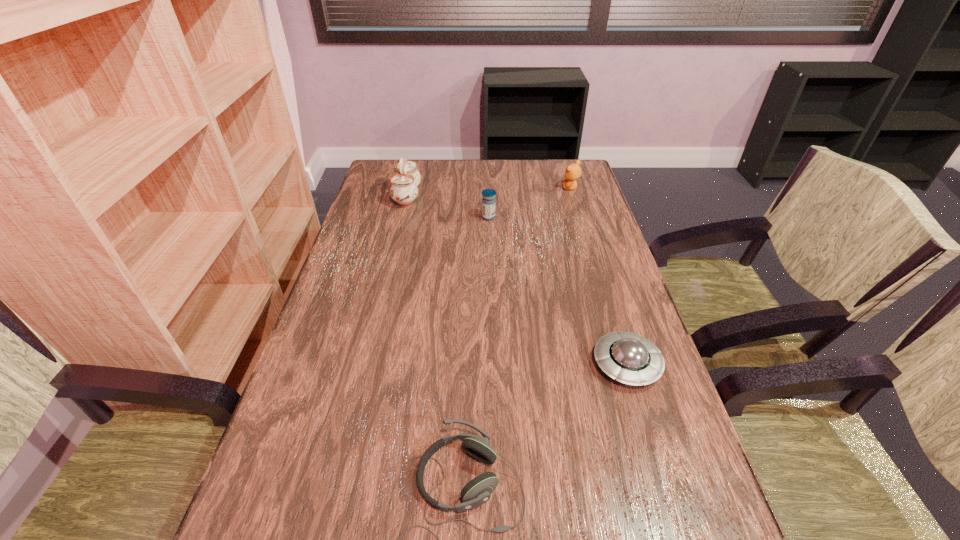
Where is `vacant space at the right edge of the desktop`? vacant space at the right edge of the desktop is located at coordinates (628, 453).

The width and height of the screenshot is (960, 540). Find the location of `vacant space at the far right corner of the desktop`. vacant space at the far right corner of the desktop is located at coordinates (568, 161).

What are the coordinates of `unoccupied area between the tallest object and the second nearest object` in the screenshot? It's located at (516, 280).

You are a GUI agent. You are given a task and a screenshot of the screen. Output one action in this format:
    pyautogui.click(x=<x>, y=<y>)
    Task: Click on the free point between the teddy bear and the saucer
    Image resolution: width=960 pixels, height=540 pixels.
    Given the screenshot: What is the action you would take?
    pyautogui.click(x=599, y=276)

The height and width of the screenshot is (540, 960). I want to click on empty space between the saucer and the third nearest object, so click(558, 291).

Locate an element on the screen. vacant space that's between the chinaware and the second nearest object is located at coordinates (516, 280).

In order to click on free point between the medicine and the second nearest object in this screenshot , I will do `click(558, 291)`.

Identify which object is located as the second nearest to the saucer. Please provide its 2D coordinates. Your answer should be formatted as a tuple, i.e. [(x, y)], where the tuple contains the x and y coordinates of a point satisfying the conditions above.

[(488, 201)]

Identify which object is the closest to the medicine. Please provide its 2D coordinates. Your answer should be formatted as a tuple, i.e. [(x, y)], where the tuple contains the x and y coordinates of a point satisfying the conditions above.

[(404, 191)]

I want to click on free region that satisfies the following two spatial constraints: 1. on the face of the fourth farthest object; 2. on the left side of the teddy bear, so click(625, 364).